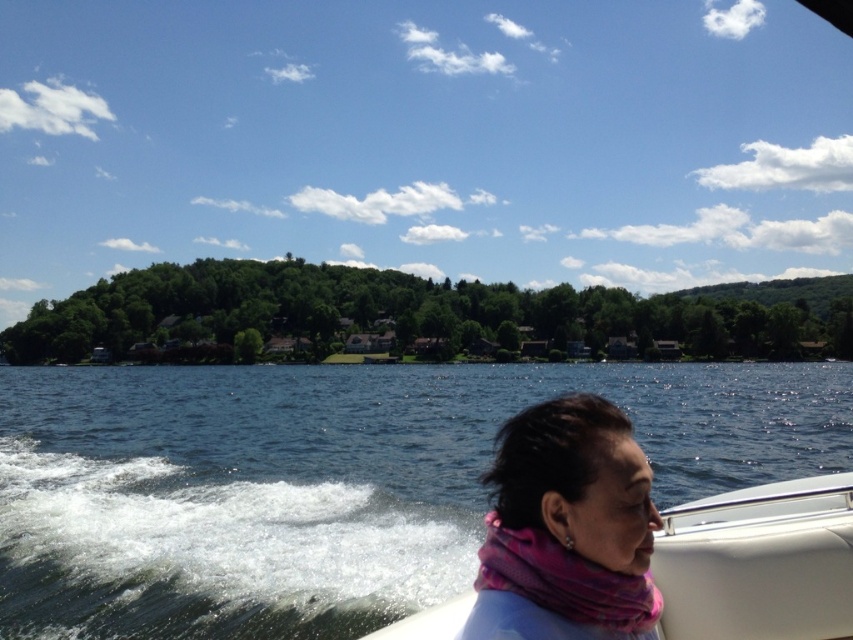
Question: Is blue water at lower left further to camera compared to white matte boat at center?

Choices:
 (A) no
 (B) yes

Answer: (B)

Question: Which point is farther from the camera taking this photo?

Choices:
 (A) (514, 464)
 (B) (840, 522)
 (C) (276, 573)

Answer: (C)

Question: Among these objects, which one is farthest from the camera?

Choices:
 (A) blue water at lower left
 (B) white matte boat at center
 (C) pink fabric scarf at lower right

Answer: (A)

Question: Does blue water at lower left appear on the right side of pink fabric scarf at lower right?

Choices:
 (A) no
 (B) yes

Answer: (B)

Question: Which point is closer to the camera taking this photo?

Choices:
 (A) [x=263, y=461]
 (B) [x=527, y=580]

Answer: (B)

Question: Can you confirm if blue water at lower left is positioned above white matte boat at center?

Choices:
 (A) no
 (B) yes

Answer: (A)